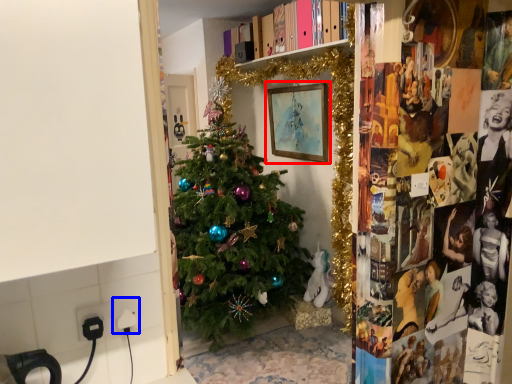
Question: Which of the following is the closest to the observer, picture frame (highlighted by a red box) or electric outlet (highlighted by a blue box)?

Choices:
 (A) picture frame
 (B) electric outlet

Answer: (B)